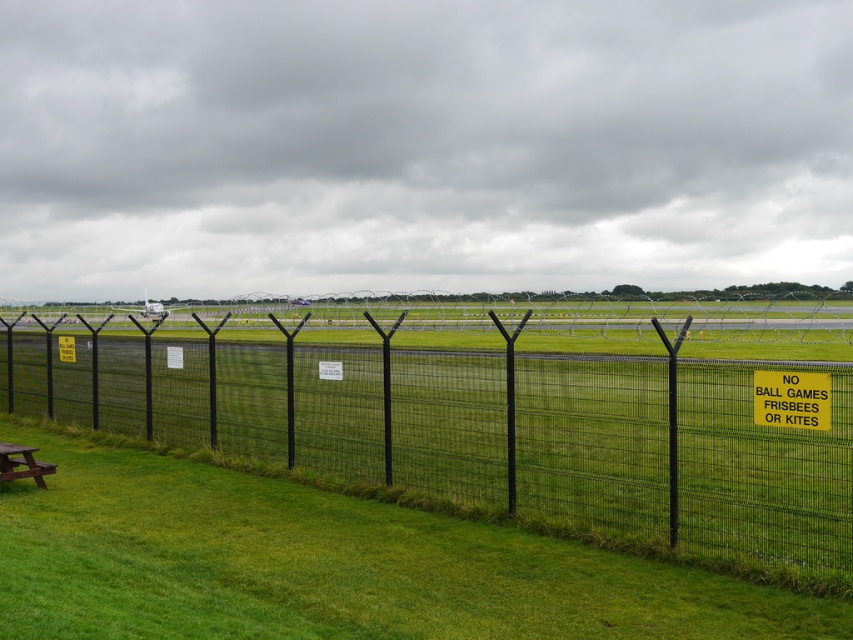
Is black wire mesh fence at center closer to the viewer compared to brown wooden picnic table at lower left?

Yes, black wire mesh fence at center is in front of brown wooden picnic table at lower left.

Is black wire mesh fence at center positioned at the back of brown wooden picnic table at lower left?

No, black wire mesh fence at center is in front of brown wooden picnic table at lower left.

Image resolution: width=853 pixels, height=640 pixels. I want to click on black wire mesh fence at center, so click(480, 429).

Image resolution: width=853 pixels, height=640 pixels. I want to click on black wire mesh fence at center, so click(480, 429).

Between black wire mesh fence at center and yellow plastic sign at center right, which one is positioned lower?

Positioned lower is black wire mesh fence at center.

Can you confirm if black wire mesh fence at center is bigger than yellow plastic sign at center right?

Correct, black wire mesh fence at center is larger in size than yellow plastic sign at center right.

The image size is (853, 640). I want to click on black wire mesh fence at center, so click(480, 429).

How far apart are yellow plastic sign at center right and brown wooden picnic table at lower left?

They are 8.66 meters apart.

Which is in front, point (780, 387) or point (9, 448)?

Point (780, 387)

In order to click on yellow plastic sign at center right in this screenshot , I will do `click(791, 397)`.